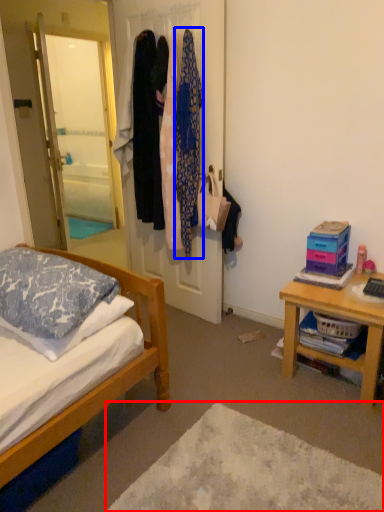
Question: Which of the following is the closest to the observer, plain (highlighted by a red box) or clothing (highlighted by a blue box)?

Choices:
 (A) plain
 (B) clothing

Answer: (A)